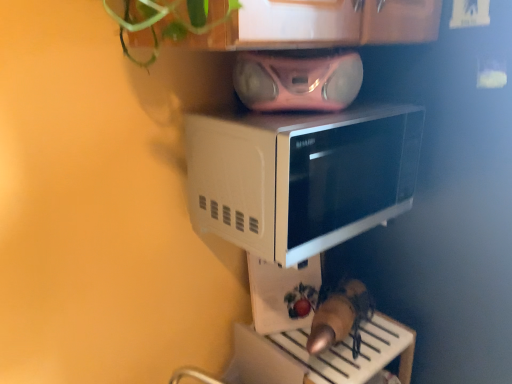
Question: From their relative heights in the image, would you say white glossy microwave at center is taller or shorter than pink metallic stereo at upper center?

Choices:
 (A) short
 (B) tall

Answer: (B)

Question: In terms of width, does white glossy microwave at center look wider or thinner when compared to pink metallic stereo at upper center?

Choices:
 (A) wide
 (B) thin

Answer: (B)

Question: Based on their relative distances, which object is farther from the pink metallic stereo at upper center?

Choices:
 (A) white glossy microwave at center
 (B) white glossy microwave at upper center

Answer: (B)

Question: Which object is the closest to the pink metallic stereo at upper center?

Choices:
 (A) white glossy microwave at upper center
 (B) white glossy microwave at center

Answer: (B)